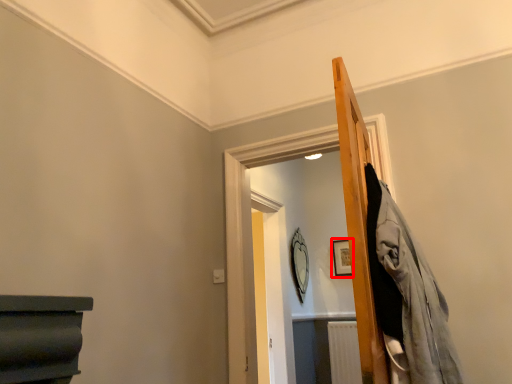
Question: From the image's perspective, what is the correct spatial relationship of picture frame (annotated by the red box) in relation to mirror?

Choices:
 (A) above
 (B) below

Answer: (A)